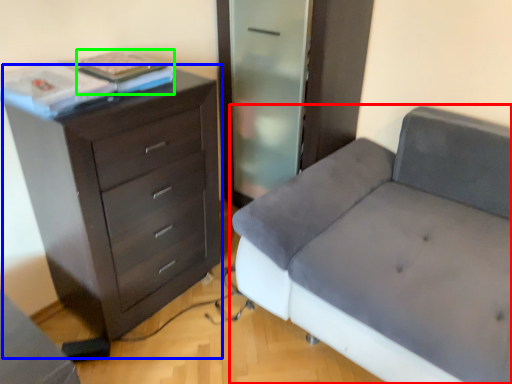
Question: Which object is positioned closest to studio couch (highlighted by a red box)? Select from chest of drawers (highlighted by a blue box) and book (highlighted by a green box).

Choices:
 (A) chest of drawers
 (B) book

Answer: (A)